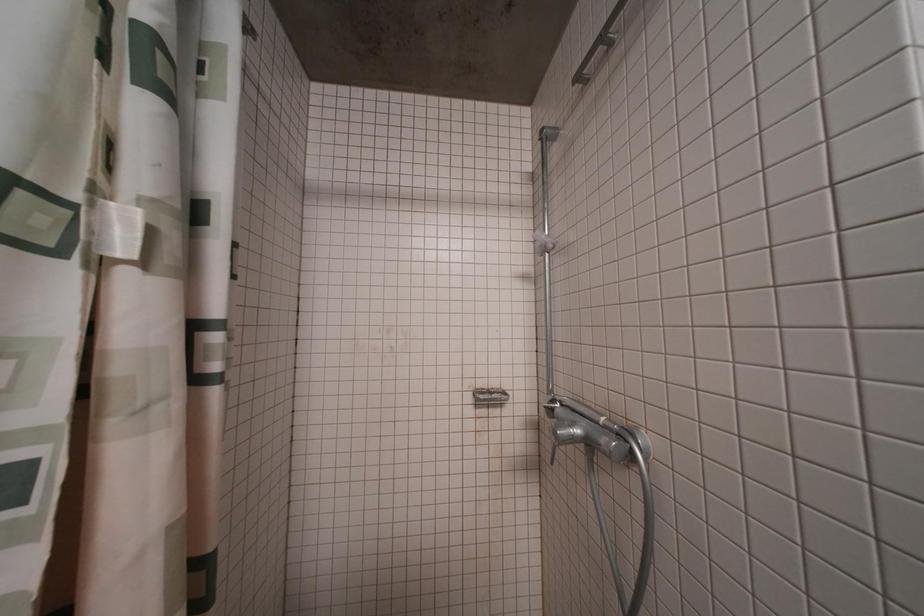
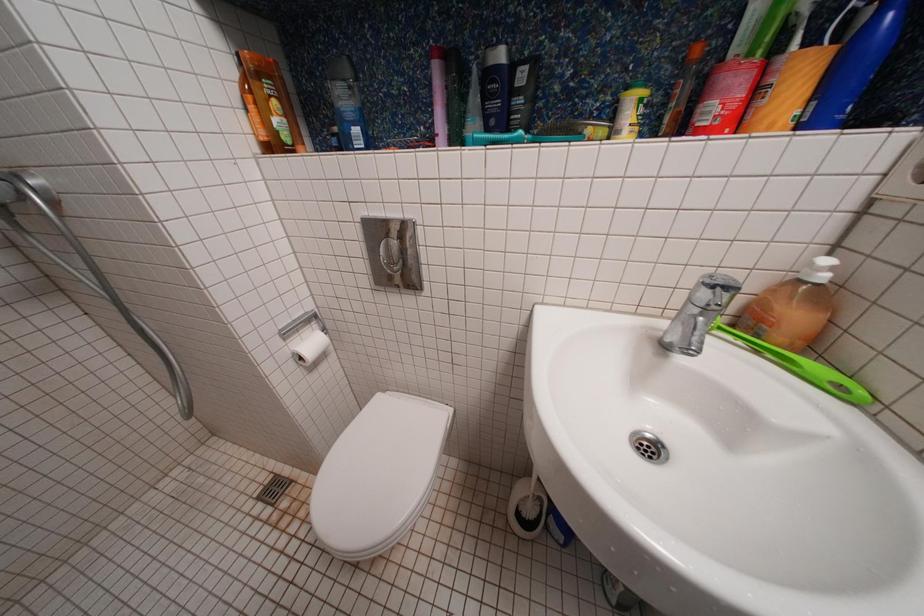
The first image is from the beginning of the video and the second image is from the end. How did the camera likely rotate when shooting the video?

The rotation direction of the camera is right-down.